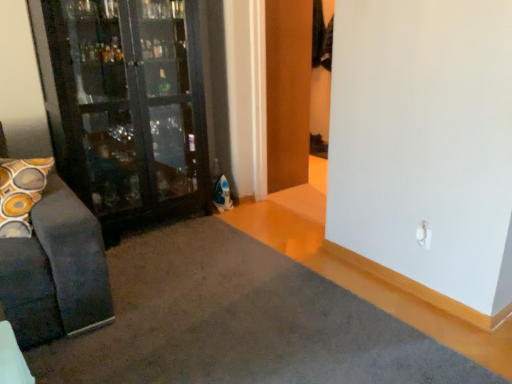
Locate an element on the screen. This screenshot has width=512, height=384. gray carpet at lower left is located at coordinates (240, 322).

Describe the element at coordinates (240, 322) in the screenshot. I see `gray carpet at lower left` at that location.

In order to face gray carpet at lower left, should I rotate leftwards or rightwards?

Rotate your view left by about 8.533°.

Describe the element at coordinates (288, 91) in the screenshot. I see `wooden door at center` at that location.

Measure the distance between point [300,48] and camera.

3.25 meters.

Where is `wooden door at center`? The width and height of the screenshot is (512, 384). wooden door at center is located at coordinates (288, 91).

Measure the distance between wooden door at center and camera.

The depth of wooden door at center is 9.63 feet.

I want to click on gray carpet at lower left, so click(x=240, y=322).

Visually, is gray carpet at lower left positioned to the left or to the right of wooden door at center?

In the image, gray carpet at lower left appears on the left side of wooden door at center.

Does gray carpet at lower left lie in front of wooden door at center?

Yes, gray carpet at lower left is closer to the camera.

Is point (137, 374) positioned in front of point (282, 143)?

Yes, it is.

Looking at this image, from the image's perspective, is gray carpet at lower left on wooden door at center?

Actually, gray carpet at lower left appears below wooden door at center in the image.

From a real-world perspective, is gray carpet at lower left below wooden door at center?

Yes.

Between gray carpet at lower left and wooden door at center, which one has smaller width?

Thinner between the two is wooden door at center.

Does gray carpet at lower left have a greater height compared to wooden door at center?

Incorrect, the height of gray carpet at lower left is not larger of that of wooden door at center.

In the scene shown: Considering the sizes of gray carpet at lower left and wooden door at center in the image, is gray carpet at lower left bigger or smaller than wooden door at center?

In the image, gray carpet at lower left appears to be smaller than wooden door at center.

Could wooden door at center be considered to be inside gray carpet at lower left?

No, wooden door at center is not surrounded by gray carpet at lower left.

Is gray carpet at lower left directly adjacent to wooden door at center?

gray carpet at lower left and wooden door at center are clearly separated.

Is gray carpet at lower left oriented towards wooden door at center?

No.

How many degrees apart are the facing directions of gray carpet at lower left and wooden door at center?

2.48 degrees separate the facing orientations of gray carpet at lower left and wooden door at center.

This screenshot has height=384, width=512. Find the location of `doormat on the left of the wooden door at center`. doormat on the left of the wooden door at center is located at coordinates (240, 322).

Considering the relative positions of wooden door at center and gray carpet at lower left in the image provided, is wooden door at center to the left of gray carpet at lower left from the viewer's perspective?

Incorrect, wooden door at center is not on the left side of gray carpet at lower left.

Is wooden door at center further to camera compared to gray carpet at lower left?

Yes.

Which point is more distant from viewer, (312, 2) or (179, 382)?

Point (312, 2)

From the image's perspective, who appears lower, wooden door at center or gray carpet at lower left?

gray carpet at lower left is shown below in the image.

From a real-world perspective, which object stands above the other?

wooden door at center is physically above.

Does wooden door at center have a greater width compared to gray carpet at lower left?

Incorrect, the width of wooden door at center does not surpass that of gray carpet at lower left.

Which of these two, wooden door at center or gray carpet at lower left, stands taller?

Standing taller between the two is wooden door at center.

Looking at the image, does wooden door at center seem bigger or smaller compared to gray carpet at lower left?

Considering their sizes, wooden door at center takes up more space than gray carpet at lower left.

Is gray carpet at lower left located within wooden door at center?

Definitely not — gray carpet at lower left is not inside wooden door at center.

Is wooden door at center directly adjacent to gray carpet at lower left?

No, wooden door at center is not in contact with gray carpet at lower left.

In the scene shown: Could you tell me if wooden door at center is turned towards gray carpet at lower left?

No, wooden door at center is not turned towards gray carpet at lower left.

Can you tell me how much wooden door at center and gray carpet at lower left differ in facing direction?

The angular difference between wooden door at center and gray carpet at lower left is 2.48 degrees.

Find the location of a particular element. The width and height of the screenshot is (512, 384). door that appears on the right of gray carpet at lower left is located at coordinates (288, 91).

The image size is (512, 384). In order to click on door that appears above the gray carpet at lower left (from a real-world perspective) in this screenshot , I will do `click(288, 91)`.

Locate an element on the screen. doormat below the wooden door at center (from the image's perspective) is located at coordinates (240, 322).